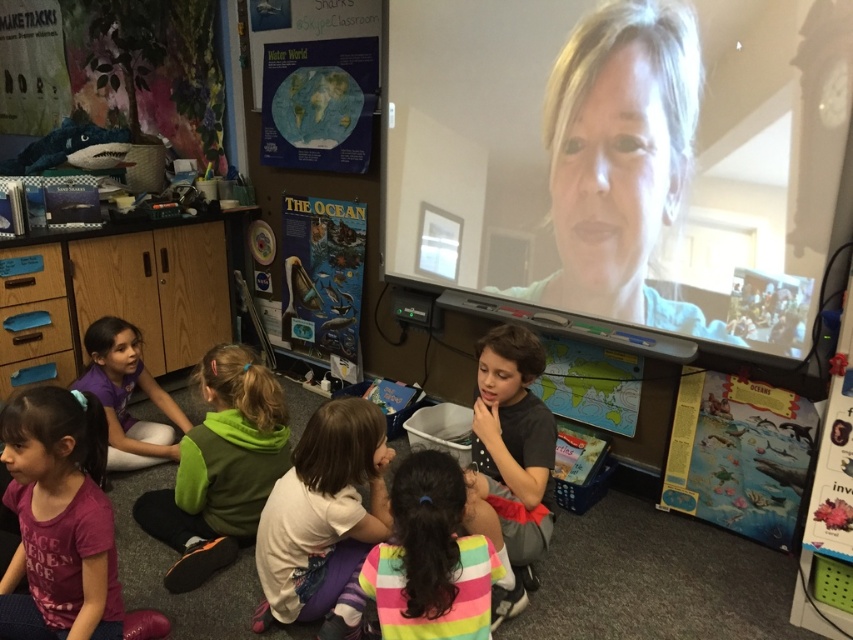
Question: Estimate the real-world distances between objects in this image. Which object is closer to the purple cotton shirt at lower left?

Choices:
 (A) blonde hair at upper center
 (B) white soft shirt at center

Answer: (B)

Question: Which object is farther from the camera taking this photo?

Choices:
 (A) matte purple shirt at lower left
 (B) multicolored striped shirt at center
 (C) purple cotton shirt at lower left
 (D) white soft shirt at center

Answer: (A)

Question: Is white soft shirt at center above matte purple shirt at lower left?

Choices:
 (A) yes
 (B) no

Answer: (B)

Question: Is purple cotton shirt at lower left behind matte purple shirt at lower left?

Choices:
 (A) yes
 (B) no

Answer: (B)

Question: Can you confirm if blonde hair at upper center is positioned to the left of multicolored striped shirt at center?

Choices:
 (A) yes
 (B) no

Answer: (B)

Question: Among these objects, which one is farthest from the camera?

Choices:
 (A) matte purple shirt at lower left
 (B) purple cotton shirt at lower left

Answer: (A)